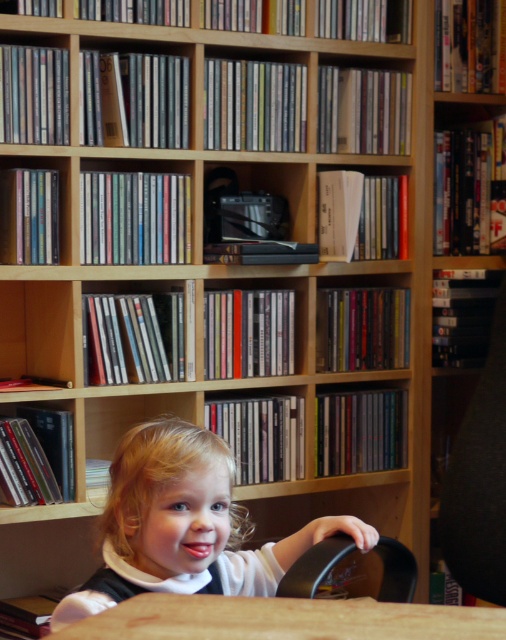
You are a photographer setting up a shot of the blonde hair toddler at center and the brown wooden table at lower center. If you need to adjust the camera height to focus on the toddler first, should you raise or lower the camera compared to the table?

The blonde hair toddler at center is taller than the brown wooden table at lower center, so you should raise the camera to focus on the toddler first.

In the scene shown: You are a photographer adjusting your camera settings to focus on two points in the image. The first point is labeled as point (196, 531) and the second is point (274, 604). Which point should you focus on first if you want to capture the closest object to the camera?

You should focus on point (196, 531) first because it is closer to the camera than point (274, 604).